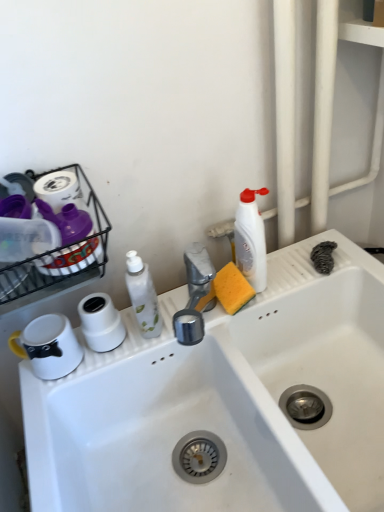
Where is `free space to the right of white matte toilet paper at center`? The image size is (384, 512). free space to the right of white matte toilet paper at center is located at coordinates (167, 330).